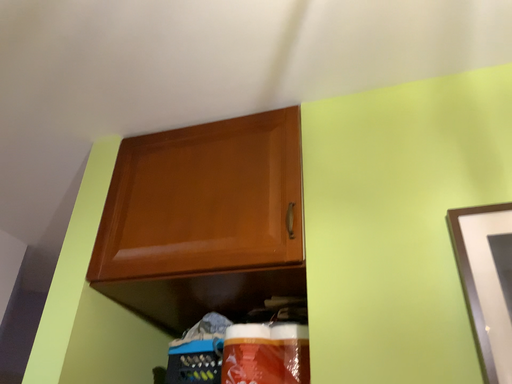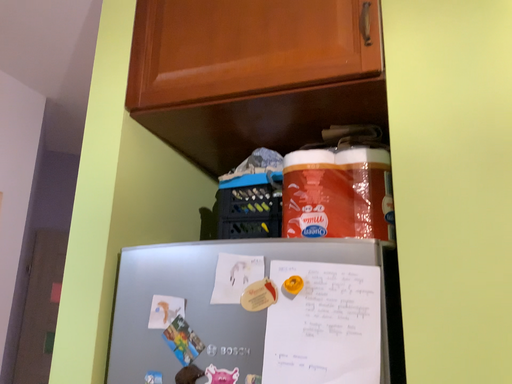
Question: How did the camera likely rotate when shooting the video?

Choices:
 (A) rotated downward
 (B) rotated upward

Answer: (A)